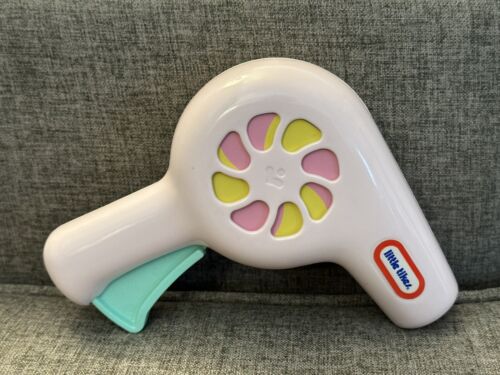
This screenshot has height=375, width=500. In order to click on gray couch back in this screenshot , I will do `click(415, 132)`.